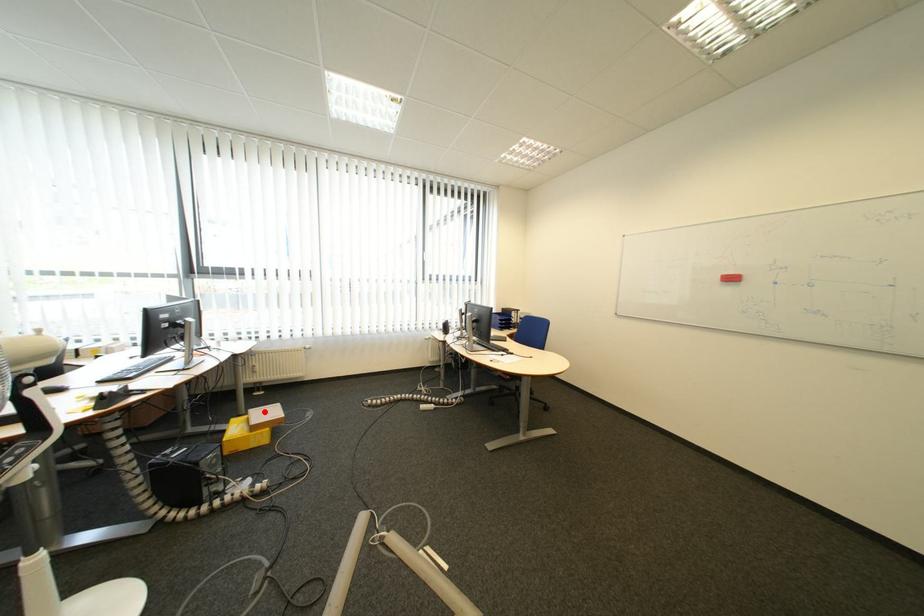
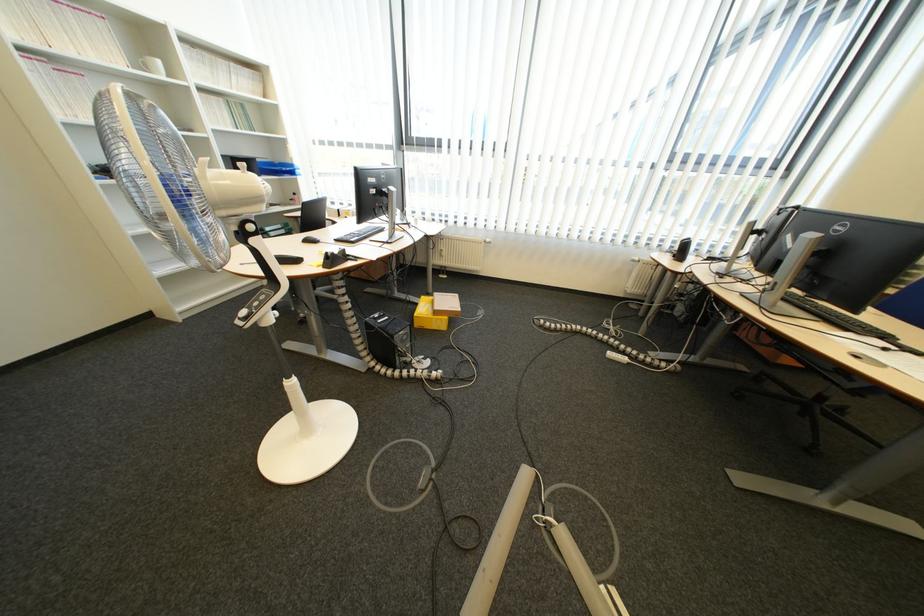
Where in the second image is the point corresponding to the highlighted location from the first image?

(448, 294)